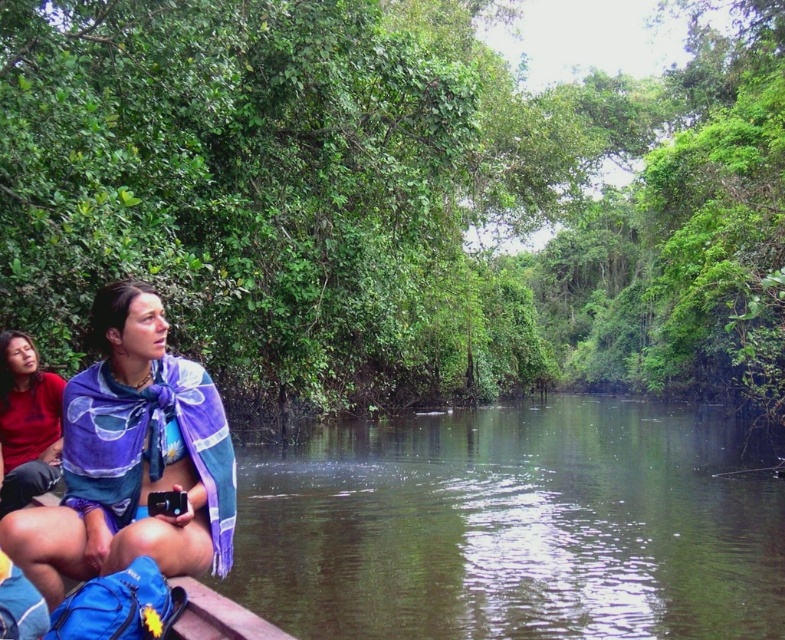
Looking at this image, you are planning to take a photo of the green leafy jungle at upper center and the purple woven scarf at lower left. Which object will occupy more space in the photo?

The green leafy jungle at upper center will occupy more space in the photo because its width is larger than the purple woven scarf at lower left.

You are on a boat in a narrow waterway and need to determine the distance between two points marked on your map. The points are labeled as point (6, 536) and point (55, 451). Based on the scene, which point is closer to you?

Point (6, 536) is closer to the viewer than point (55, 451).

What is the 2D coordinate of the green leafy jungle at upper center in the image?

The 2D coordinate of the green leafy jungle at upper center is at point (393, 198).